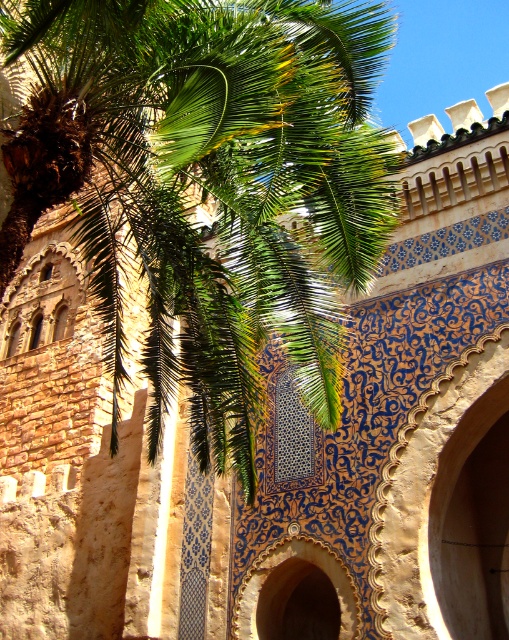
Question: Is green leafy palm at upper left bigger than blue glazed tile archway at center?

Choices:
 (A) yes
 (B) no

Answer: (A)

Question: Does green leafy palm at upper left have a lesser width compared to blue glazed tile archway at center?

Choices:
 (A) no
 (B) yes

Answer: (A)

Question: Which of the following is the farthest from the observer?

Choices:
 (A) (234, 390)
 (B) (268, 572)

Answer: (B)

Question: Is green leafy palm at upper left to the right of blue glazed tile archway at center from the viewer's perspective?

Choices:
 (A) yes
 (B) no

Answer: (B)